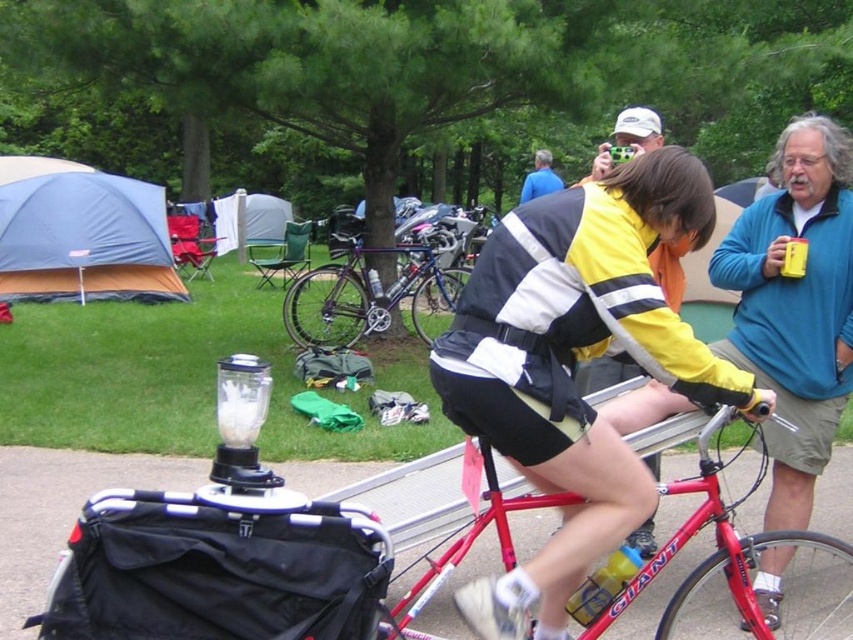
Question: Can you confirm if blue fabric tent at upper left is smaller than red matte bicycle at center?

Choices:
 (A) no
 (B) yes

Answer: (A)

Question: Considering the relative positions of blue fleece jacket at upper right and red matte bicycle at center in the image provided, where is blue fleece jacket at upper right located with respect to red matte bicycle at center?

Choices:
 (A) above
 (B) below

Answer: (A)

Question: Is yellow matte jacket at center below blue fleece jacket at upper right?

Choices:
 (A) no
 (B) yes

Answer: (A)

Question: Which object appears closest to the camera in this image?

Choices:
 (A) blue fabric shirt at upper center
 (B) red matte bicycle at center
 (C) shiny metallic bicycle at center

Answer: (B)

Question: Which object is closer to the camera taking this photo?

Choices:
 (A) blue fleece jacket at upper right
 (B) red matte bicycle at center
 (C) shiny metallic bicycle at center

Answer: (B)

Question: Among these objects, which one is nearest to the camera?

Choices:
 (A) red matte bicycle at center
 (B) blue fabric shirt at upper center
 (C) blue fabric tent at upper left

Answer: (A)